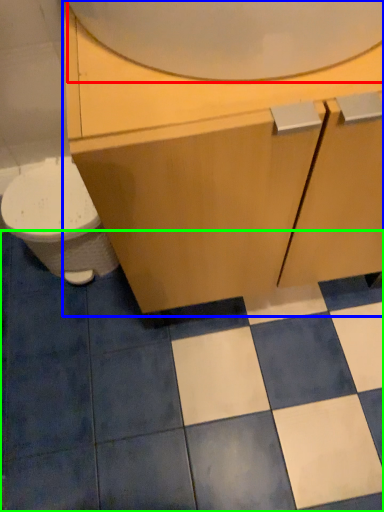
Question: Based on their relative distances, which object is nearer to mirror (highlighted by a red box)? Choose from bathroom cabinet (highlighted by a blue box) and ceramic tile (highlighted by a green box).

Choices:
 (A) bathroom cabinet
 (B) ceramic tile

Answer: (A)